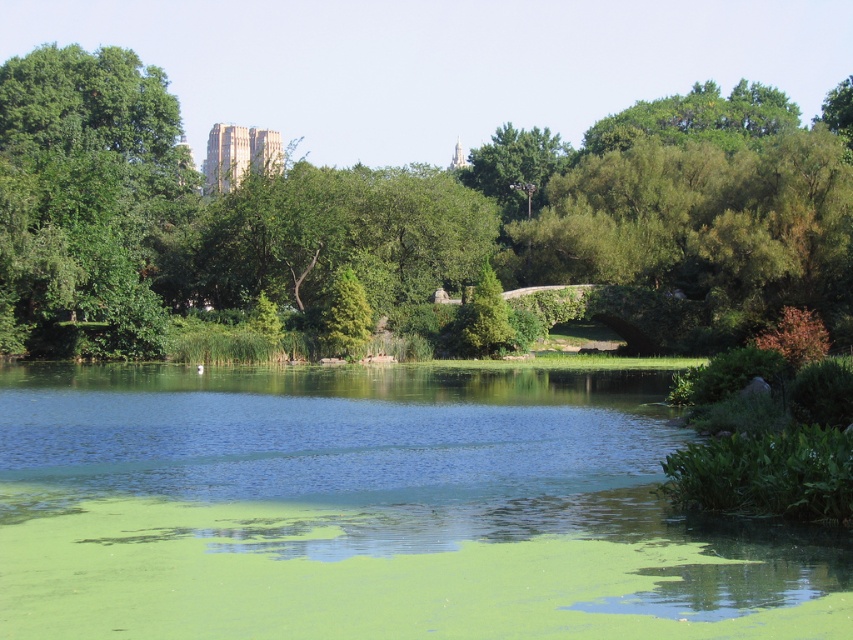
You are standing at the point labeled point (68, 452) and want to walk to the point labeled point (51, 64). Which direction should you move to get closer to your destination?

You should move away from the camera because point (68, 452) is closer to the camera than point (51, 64), so moving away from the camera will bring you closer to your destination.